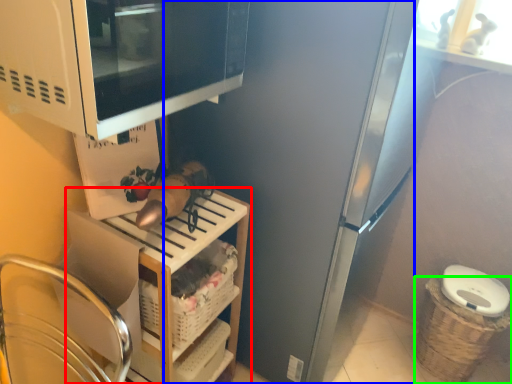
Question: Which object is the farthest from shelf (highlighted by a red box)? Choose among these: appliance (highlighted by a blue box) or basket (highlighted by a green box).

Choices:
 (A) appliance
 (B) basket

Answer: (B)